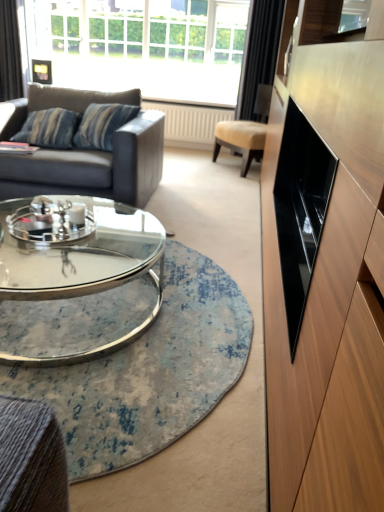
Question: Is black velvet curtain at upper left, which is the first curtain in left-to-right order, to the left or to the right of white glass window at upper center in the image?

Choices:
 (A) left
 (B) right

Answer: (A)

Question: Considering the positions of black velvet curtain at upper left, arranged as the 2th curtain when viewed from the right, and white glass window at upper center in the image, is black velvet curtain at upper left, arranged as the 2th curtain when viewed from the right, wider or thinner than white glass window at upper center?

Choices:
 (A) wide
 (B) thin

Answer: (B)

Question: Which is farther from the black glossy drawer at right?

Choices:
 (A) black velvet curtain at upper left, which is the first curtain in left-to-right order
 (B) clear glass coffee table at center
 (C) white glass window at upper center
 (D) dark gray leather couch at left
 (E) glass/metal coffee table at center

Answer: (C)

Question: Considering the real-world distances, which object is farthest from the dark gray leather couch at left?

Choices:
 (A) black velvet curtain at upper left, arranged as the 2th curtain when viewed from the right
 (B) black glossy drawer at right
 (C) clear glass coffee table at center
 (D) beige leather chair at center
 (E) white glass window at upper center

Answer: (E)